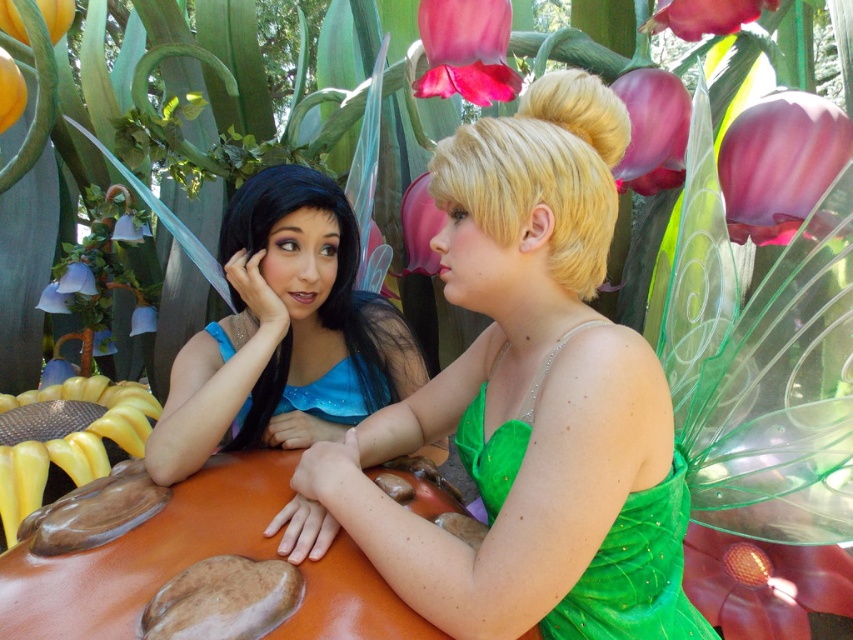
You are a photographer setting up a shoot in this scene. You need to position a spotlight to the right of both the green satin dress at center and the purple matte flower at upper center. Is this possible given their positions?

The green satin dress at center is to the left of the purple matte flower at upper center, so placing a spotlight to the right of both would be possible as they are aligned horizontally with the dress on the left and the flower on the right.

You are a photographer trying to capture a closeup of the purple matte flower at upper center. Based on the scene description, where should you position yourself to ensure the flower is in the center of your frame?

The purple matte flower at upper center is located at point coordinates [780,163], so you should position yourself slightly to the left and lower your camera to center the flower in your frame.